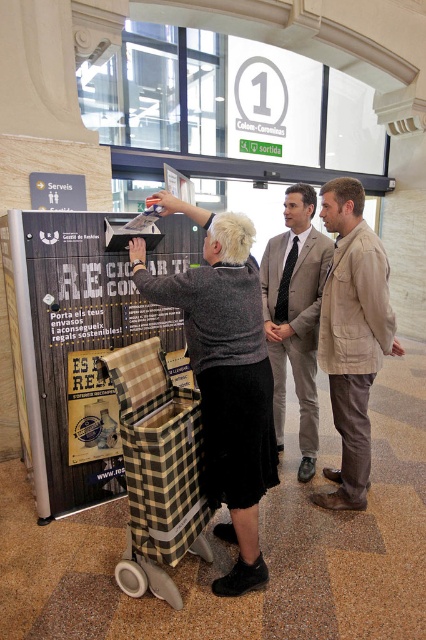
Question: Observing the image, what is the correct spatial positioning of plaid fabric shopping cart at center in reference to light beige suit at center?

Choices:
 (A) right
 (B) left

Answer: (B)

Question: Among these objects, which one is nearest to the camera?

Choices:
 (A) plaid fabric shopping cart at center
 (B) beige fabric jacket at center

Answer: (A)

Question: Is wooden plaid basket at center thinner than light beige suit at center?

Choices:
 (A) no
 (B) yes

Answer: (A)

Question: Which is farther from the light beige suit at center?

Choices:
 (A) beige fabric jacket at center
 (B) wooden plaid basket at center
 (C) plaid fabric shopping cart at center

Answer: (C)

Question: Which is farther from the light beige suit at center?

Choices:
 (A) wooden plaid basket at center
 (B) beige fabric jacket at center
 (C) plaid fabric shopping cart at center

Answer: (C)

Question: Does wooden plaid basket at center have a greater width compared to light beige suit at center?

Choices:
 (A) no
 (B) yes

Answer: (B)